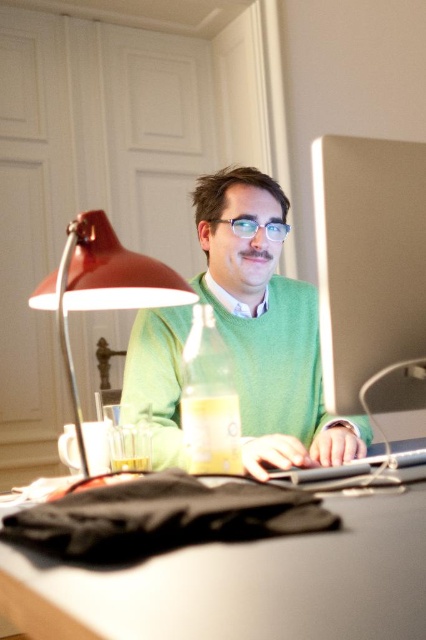
Does green matte sweater at center have a lesser width compared to translucent glass beverage at desk center?

No.

The width and height of the screenshot is (426, 640). Describe the element at coordinates (267, 326) in the screenshot. I see `green matte sweater at center` at that location.

You are a GUI agent. You are given a task and a screenshot of the screen. Output one action in this format:
    pyautogui.click(x=<x>, y=<y>)
    Task: Click on the green matte sweater at center
    
    Given the screenshot: What is the action you would take?
    pyautogui.click(x=267, y=326)

Is translucent yellow bottle at center thinner than sleek silver laptop at center?

Yes.

Where is `translucent yellow bottle at center`? translucent yellow bottle at center is located at coordinates (209, 401).

Is sleek silver laptop at center below translucent glass beverage at desk center?

Actually, sleek silver laptop at center is above translucent glass beverage at desk center.

Which of these two, sleek silver laptop at center or translucent glass beverage at desk center, stands taller?

sleek silver laptop at center is taller.

Describe the element at coordinates (356, 467) in the screenshot. I see `sleek silver laptop at center` at that location.

Locate an element on the screen. This screenshot has height=640, width=426. sleek silver laptop at center is located at coordinates (356, 467).